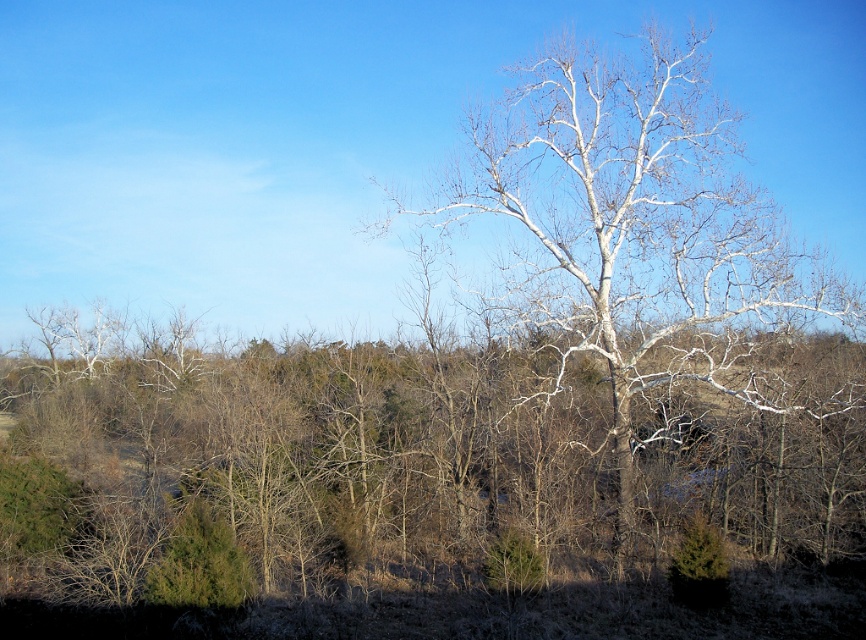
Is bare branches at center shorter than white bark tree at center?

Yes.

Which of these two, bare branches at center or white bark tree at center, stands shorter?

bare branches at center

The width and height of the screenshot is (866, 640). In order to click on bare branches at center in this screenshot , I will do `click(418, 451)`.